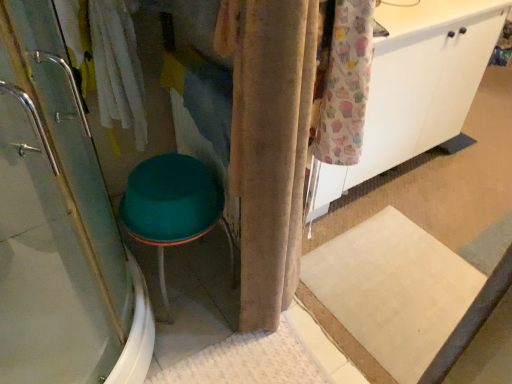
Identify the location of vacant space in between velvet beige curtain at center and teal plastic stool at lower left. The width and height of the screenshot is (512, 384). (205, 307).